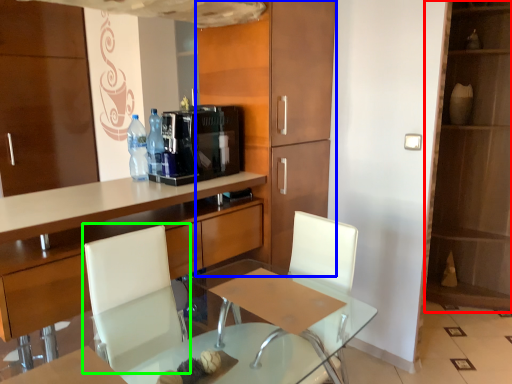
Question: Which object is the farthest from dresser (highlighted by a red box)? Choose among these: cabinetry (highlighted by a blue box) or armchair (highlighted by a green box).

Choices:
 (A) cabinetry
 (B) armchair

Answer: (B)